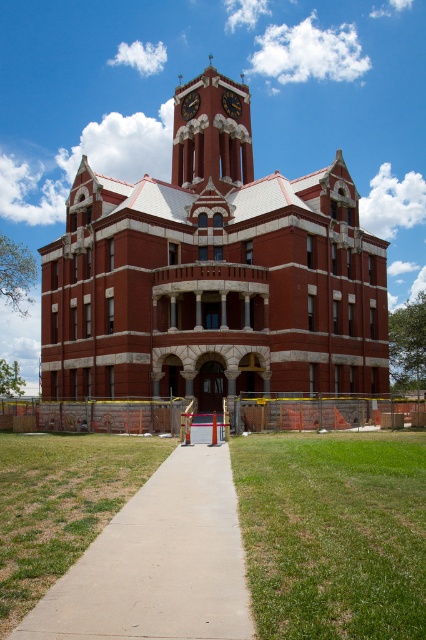
Question: Estimate the real-world distances between objects in this image. Which object is closer to the matte red brick clock tower at upper center?

Choices:
 (A) red brick tower at center
 (B) matte black clock at upper center
 (C) concrete at center
 (D) gold metallic clock at upper center

Answer: (B)

Question: Among these objects, which one is farthest from the camera?

Choices:
 (A) gold metallic clock at upper center
 (B) red brick tower at center
 (C) matte red brick clock tower at upper center

Answer: (A)

Question: Is red brick tower at center below concrete at center?

Choices:
 (A) no
 (B) yes

Answer: (A)

Question: Does concrete at center appear on the left side of gold metallic clock at upper center?

Choices:
 (A) yes
 (B) no

Answer: (B)

Question: Among these points, which one is farthest from the camera?

Choices:
 (A) (187, 116)
 (B) (173, 102)
 (C) (201, 264)
 (D) (98, 596)

Answer: (B)

Question: Does red brick tower at center have a lesser width compared to concrete at center?

Choices:
 (A) no
 (B) yes

Answer: (A)